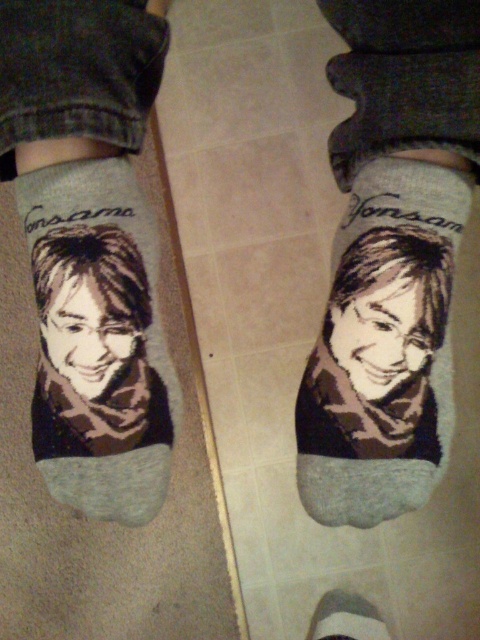
Can you confirm if matte gray socks at center is positioned below printed fabric socks at center?

Yes.

Between point (410, 420) and point (127, 244), which one is positioned behind?

Positioned behind is point (127, 244).

Is point (312, 420) farther from viewer compared to point (84, 246)?

Yes, point (312, 420) is behind point (84, 246).

Identify the location of matte gray socks at center. (383, 348).